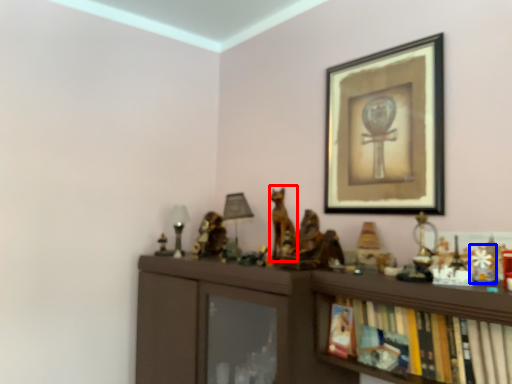
Question: Which object appears closest to the camera in this image, animal (highlighted by a red box) or toy (highlighted by a blue box)?

Choices:
 (A) animal
 (B) toy

Answer: (B)